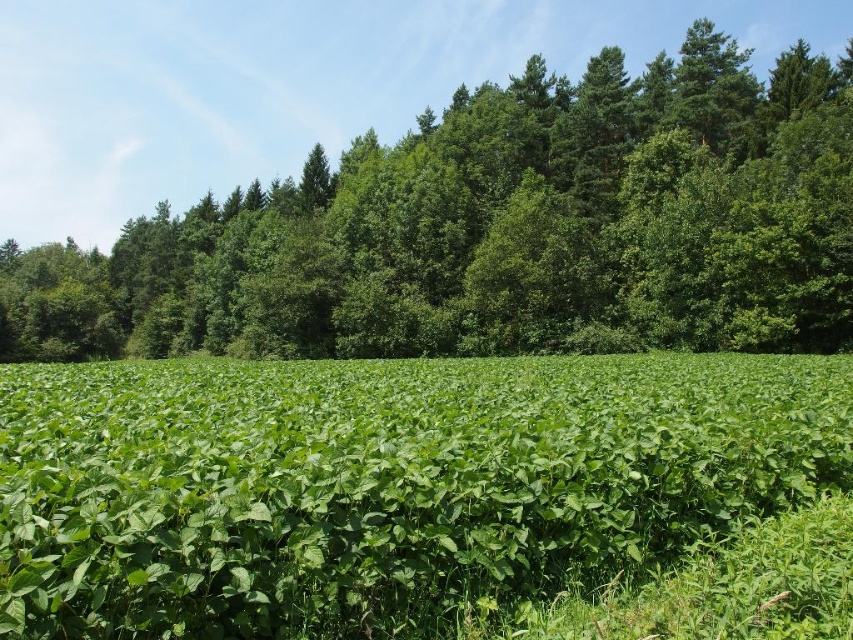
Question: Which point is closer to the camera?

Choices:
 (A) (47, 413)
 (B) (712, 148)

Answer: (A)

Question: Which of the following is the farthest from the observer?

Choices:
 (A) green leafy field at center
 (B) green leafy tree at center

Answer: (B)

Question: Which point appears closest to the camera in this image?

Choices:
 (A) (564, 504)
 (B) (352, 349)

Answer: (A)

Question: Can you confirm if green leafy field at center is positioned below green leafy tree at center?

Choices:
 (A) no
 (B) yes

Answer: (B)

Question: Does green leafy field at center appear under green leafy tree at center?

Choices:
 (A) yes
 (B) no

Answer: (A)

Question: Is green leafy field at center to the left of green leafy tree at center from the viewer's perspective?

Choices:
 (A) yes
 (B) no

Answer: (B)